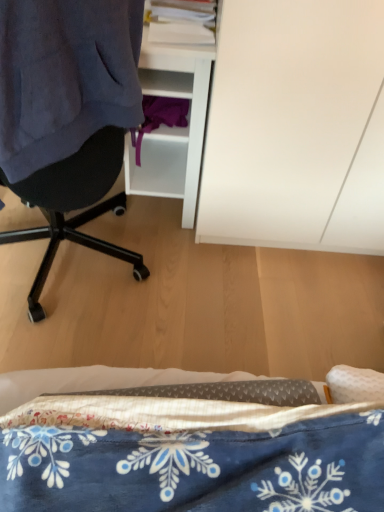
Question: Considering their positions, is white matte cabinet at upper right located in front of or behind dark blue fabric at left?

Choices:
 (A) front
 (B) behind

Answer: (B)

Question: Would you say white matte cabinet at upper right is to the left or to the right of dark blue fabric at left in the picture?

Choices:
 (A) left
 (B) right

Answer: (B)

Question: Which is farther from the blue printed fabric at lower center?

Choices:
 (A) white matte cabinet at upper right
 (B) dark blue fabric at left

Answer: (A)

Question: Estimate the real-world distances between objects in this image. Which object is farther from the blue printed fabric at lower center?

Choices:
 (A) white matte cabinet at upper right
 (B) dark blue fabric at left

Answer: (A)